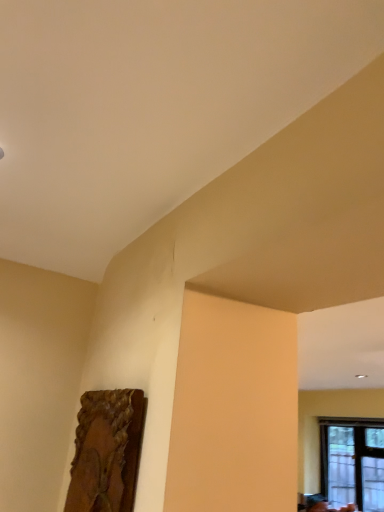
What do you see at coordinates (352, 461) in the screenshot? I see `transparent glass window at lower right` at bounding box center [352, 461].

Measure the distance between transparent glass window at lower right and camera.

transparent glass window at lower right is 3.90 meters away from camera.

Identify the location of transparent glass window at lower right. Image resolution: width=384 pixels, height=512 pixels. pos(352,461).

Describe the element at coordinates (106, 451) in the screenshot. The height and width of the screenshot is (512, 384). I see `wooden frame at lower left` at that location.

Measure the distance between point (x=134, y=429) and camera.

Point (x=134, y=429) is 91.40 centimeters from camera.

The width and height of the screenshot is (384, 512). Identify the location of wooden frame at lower left. (106, 451).

The height and width of the screenshot is (512, 384). Identify the location of transparent glass window at lower right. (352, 461).

Considering the relative positions of transparent glass window at lower right and wooden frame at lower left in the image provided, is transparent glass window at lower right to the right of wooden frame at lower left from the viewer's perspective?

Correct, you'll find transparent glass window at lower right to the right of wooden frame at lower left.

Is transparent glass window at lower right positioned in front of wooden frame at lower left?

No, transparent glass window at lower right is further to the viewer.

Does point (340, 432) lie behind point (120, 489)?

Yes, it is.

From the image's perspective, is transparent glass window at lower right under wooden frame at lower left?

Correct, transparent glass window at lower right appears lower than wooden frame at lower left in the image.

From a real-world perspective, is transparent glass window at lower right beneath wooden frame at lower left?

Correct, in the physical world, transparent glass window at lower right is lower than wooden frame at lower left.

Looking at their sizes, would you say transparent glass window at lower right is wider or thinner than wooden frame at lower left?

Considering their sizes, transparent glass window at lower right looks broader than wooden frame at lower left.

Considering the sizes of objects transparent glass window at lower right and wooden frame at lower left in the image provided, who is taller, transparent glass window at lower right or wooden frame at lower left?

transparent glass window at lower right is taller.

Considering the sizes of transparent glass window at lower right and wooden frame at lower left in the image, is transparent glass window at lower right bigger or smaller than wooden frame at lower left?

In the image, transparent glass window at lower right appears to be larger than wooden frame at lower left.

Would you say transparent glass window at lower right is inside or outside wooden frame at lower left?

transparent glass window at lower right is outside wooden frame at lower left.

Is transparent glass window at lower right positioned far away from wooden frame at lower left?

That's right, there is a large distance between transparent glass window at lower right and wooden frame at lower left.

Is transparent glass window at lower right positioned with its back to wooden frame at lower left?

No, transparent glass window at lower right is not facing the opposite direction of wooden frame at lower left.

How many degrees apart are the facing directions of transparent glass window at lower right and wooden frame at lower left?

The facing directions of transparent glass window at lower right and wooden frame at lower left are 0.00994 degrees apart.

Find the location of a particular element. This screenshot has height=512, width=384. picture frame located above the transparent glass window at lower right (from the image's perspective) is located at coordinates (106, 451).

Considering the relative positions of wooden frame at lower left and transparent glass window at lower right in the image provided, is wooden frame at lower left to the right of transparent glass window at lower right from the viewer's perspective?

In fact, wooden frame at lower left is to the left of transparent glass window at lower right.

Between wooden frame at lower left and transparent glass window at lower right, which one is positioned behind?

transparent glass window at lower right is further away from the camera.

Which is behind, point (123, 454) or point (333, 465)?

Point (333, 465)

From the image's perspective, would you say wooden frame at lower left is positioned over transparent glass window at lower right?

Correct, wooden frame at lower left appears higher than transparent glass window at lower right in the image.

From a real-world perspective, is wooden frame at lower left on top of transparent glass window at lower right?

Correct, in the physical world, wooden frame at lower left is higher than transparent glass window at lower right.

Considering the relative sizes of wooden frame at lower left and transparent glass window at lower right in the image provided, is wooden frame at lower left thinner than transparent glass window at lower right?

Yes.

In the scene shown: Considering the relative sizes of wooden frame at lower left and transparent glass window at lower right in the image provided, is wooden frame at lower left shorter than transparent glass window at lower right?

Yes.

Does wooden frame at lower left have a smaller size compared to transparent glass window at lower right?

Correct, wooden frame at lower left occupies less space than transparent glass window at lower right.

Is transparent glass window at lower right completely or partially inside wooden frame at lower left?

No, transparent glass window at lower right is not surrounded by wooden frame at lower left.

Are wooden frame at lower left and transparent glass window at lower right far apart?

wooden frame at lower left is positioned a significant distance from transparent glass window at lower right.

Is wooden frame at lower left oriented towards transparent glass window at lower right?

No, wooden frame at lower left is not facing towards transparent glass window at lower right.

What's the angular difference between wooden frame at lower left and transparent glass window at lower right's facing directions?

0.00994 degrees.

Image resolution: width=384 pixels, height=512 pixels. What are the coordinates of `picture frame located on the left of transparent glass window at lower right` in the screenshot? It's located at (106, 451).

The height and width of the screenshot is (512, 384). I want to click on picture frame on the left of transparent glass window at lower right, so click(x=106, y=451).

Where is `window below the wooden frame at lower left (from the image's perspective)`? window below the wooden frame at lower left (from the image's perspective) is located at coordinates (352, 461).